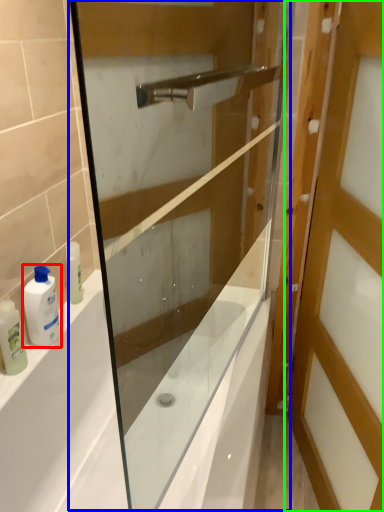
Question: Estimate the real-world distances between objects in this image. Which object is farther from toiletry (highlighted by a red box), screen door (highlighted by a blue box) or door (highlighted by a green box)?

Choices:
 (A) screen door
 (B) door

Answer: (B)